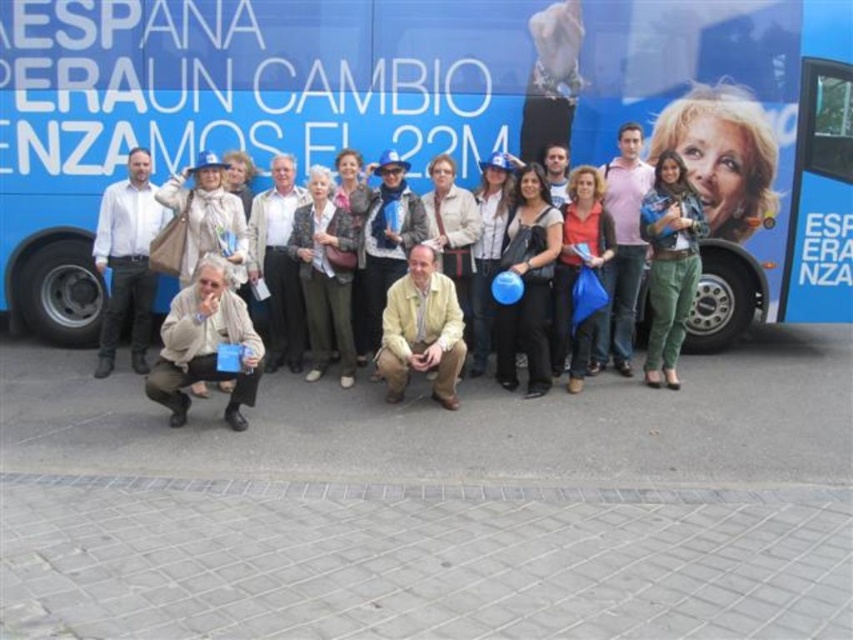
You are a photographer trying to capture a clear shot of the blue matte bus at center and the light beige sweater at center. Which object should you focus on first to ensure it appears larger in the photo?

The blue matte bus at center is much taller than the light beige sweater at center, so you should focus on the blue matte bus at center first to ensure it appears larger in the photo.

You are a photographer standing 10 feet away from the white shirt at left and the pink cotton shirt at center. Can you fit both shirts into your camera frame without moving? The camera has a maximum horizontal field of view of 12 feet.

The distance between the white shirt at left and the pink cotton shirt at center is 14.39 feet, which exceeds the camera frame of 12 feet. Therefore, you cannot fit both shirts into the frame without moving.